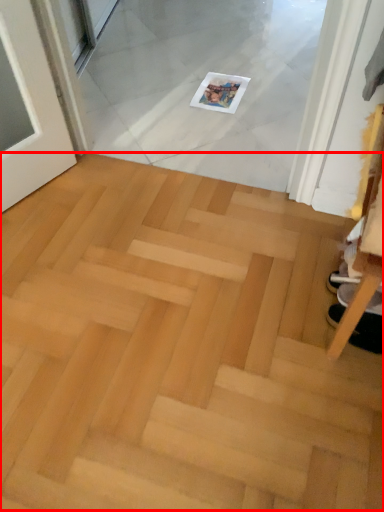
Question: Observing the image, what is the correct spatial positioning of stairwell (annotated by the red box) in reference to footwear?

Choices:
 (A) right
 (B) left

Answer: (B)